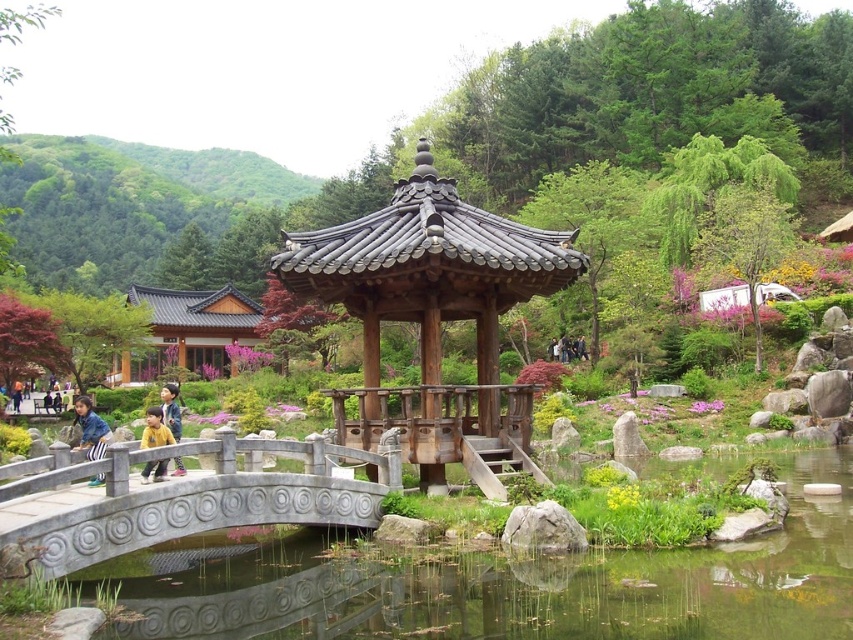
Which is in front, point (764, 540) or point (436, 189)?

Point (764, 540) is more forward.

Which is behind, point (410, 632) or point (488, 259)?

The point (488, 259) is more distant.

Identify the location of clear water at bridge left. The image size is (853, 640). (517, 586).

Is point (398, 605) farther from camera compared to point (173, 428)?

No, it is not.

Which is more to the left, clear water at bridge left or yellow matte jacket at center?

yellow matte jacket at center is more to the left.

Is point (579, 573) positioned before point (177, 467)?

Yes, it is.

Where is `clear water at bridge left`? clear water at bridge left is located at coordinates tap(517, 586).

Who is shorter, gray stone bridge at lower left or yellow cotton shirt at center?

gray stone bridge at lower left

Is point (68, 563) positioned in front of point (154, 440)?

Yes, point (68, 563) is closer to viewer.

Is point (192, 484) positioned before point (152, 412)?

Yes, point (192, 484) is in front of point (152, 412).

Locate an element on the screen. gray stone bridge at lower left is located at coordinates (189, 499).